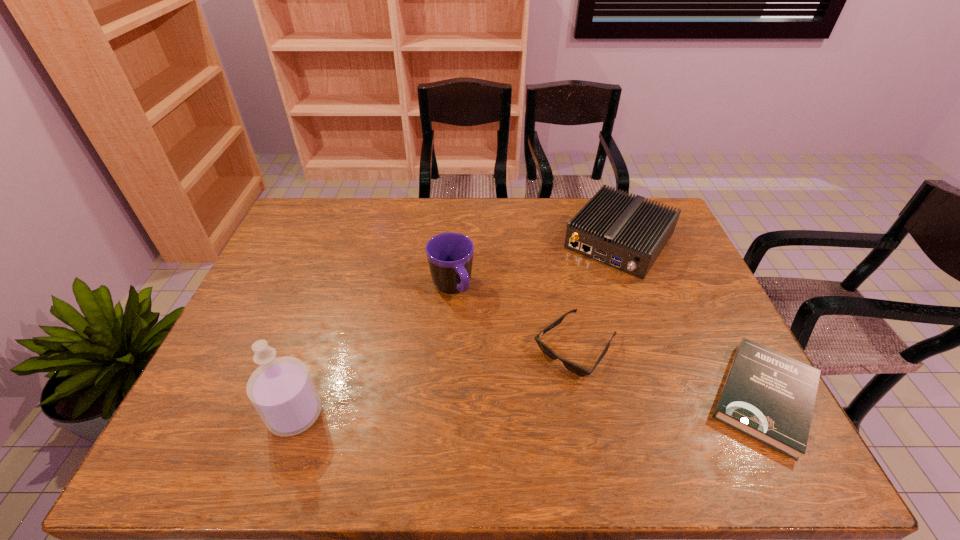
The width and height of the screenshot is (960, 540). In order to click on vacant space on the desktop that is between the perfume and the shortest object and is positioned with the handle on the side of the fourth shortest object in this screenshot , I will do `click(519, 406)`.

I want to click on vacant spot on the desktop that is between the perfume and the shortest object and is positioned on the front-facing side of the sunglasses, so click(522, 406).

The width and height of the screenshot is (960, 540). What are the coordinates of `free spot on the desktop that is between the tallest object and the book and is positioned on the back panel of the third tallest object` in the screenshot? It's located at (492, 407).